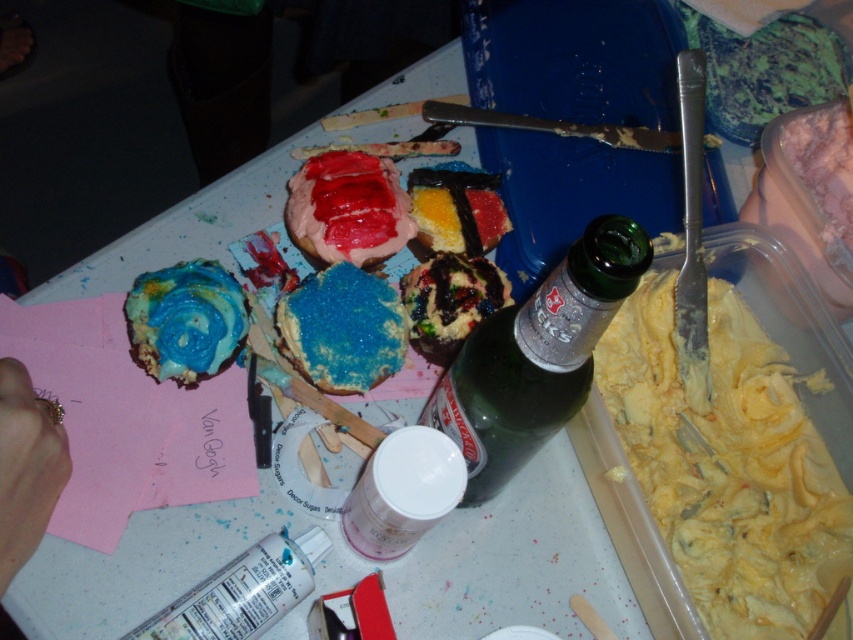
You are standing at the edge of the table and want to reach the green glass bottle at center. Considering the table is 1.2 meters wide from left to right, can you estimate whether the bottle is closer to the left or right edge of the table?

The green glass bottle at center is located at point 0.559 on the horizontal axis. Since the table is 1.2 meters wide, the midpoint is at 0.6 meters. The bottle is slightly to the right of the center, so it is closer to the right edge of the table.